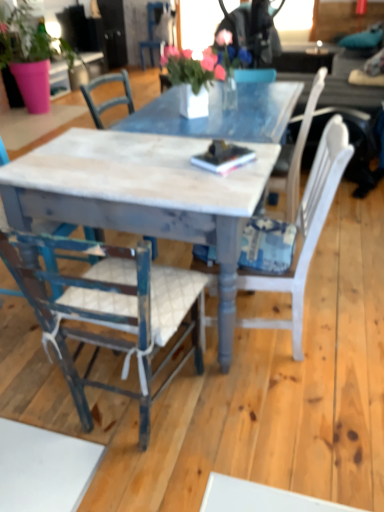
Question: From a real-world perspective, relative to white painted wood chair at left, which appears as the 2th chair when viewed from the top, is pink fabric plant at left vertically above or below?

Choices:
 (A) below
 (B) above

Answer: (B)

Question: Do you think pink fabric plant at left is within white painted wood chair at left, the 2th chair in the back-to-front sequence, or outside of it?

Choices:
 (A) outside
 (B) inside

Answer: (A)

Question: Which of these objects is positioned farthest from the pink fabric floral arrangement at center?

Choices:
 (A) distressed wood chair at center, which is counted as the 4th chair, starting from the top
 (B) pink fabric plant at left
 (C) white painted wood chair at left, the 2th chair in the back-to-front sequence
 (D) white painted wood chair at center, the 3th chair in the top-to-bottom sequence
 (E) blue painted wood chair at upper center, positioned as the first chair in top-to-bottom order

Answer: (E)

Question: Estimate the real-world distances between objects in this image. Which object is farther from the blue painted wood chair at upper center, the fourth chair when ordered from bottom to top?

Choices:
 (A) white marble table at center
 (B) pink fabric floral arrangement at center
 (C) white painted wood chair at left, placed as the third chair when sorted from bottom to top
 (D) pink fabric plant at left
 (E) distressed wood chair at center, which appears as the 1th chair when viewed from the front

Answer: (E)